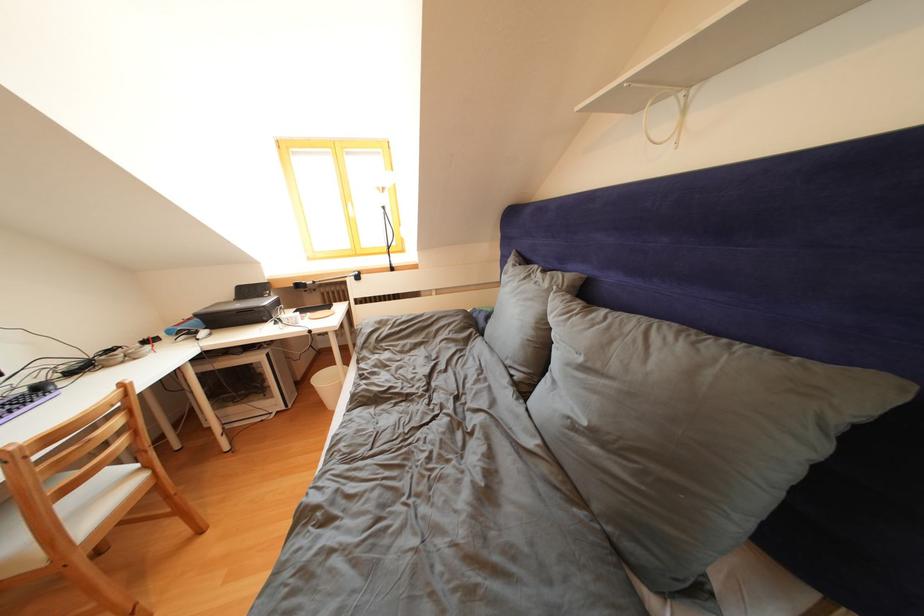
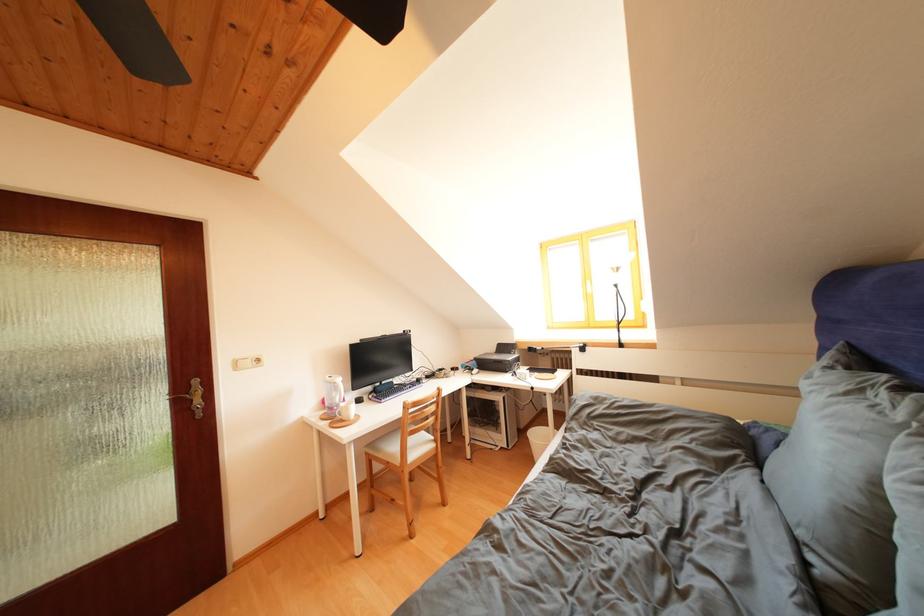
Locate, in the second image, the point that corresponds to point 330,384 in the first image.

(542, 439)